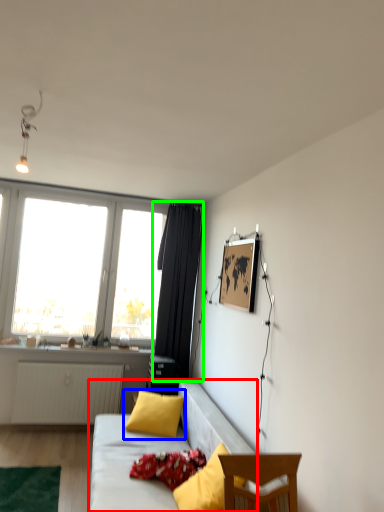
Question: Which object is the farthest from studio couch (highlighted by a red box)? Choose among these: pillow (highlighted by a blue box) or curtain (highlighted by a green box).

Choices:
 (A) pillow
 (B) curtain

Answer: (B)